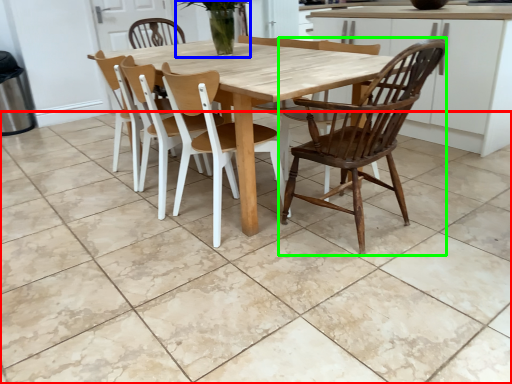
Question: Which object is positioned farthest from tile (highlighted by a red box)? Select from plant (highlighted by a blue box) and chair (highlighted by a green box).

Choices:
 (A) plant
 (B) chair

Answer: (A)